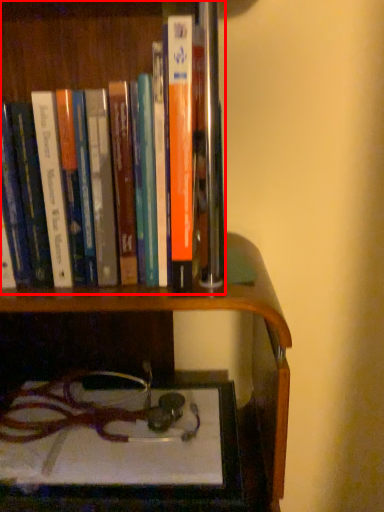
Question: Where is book (annotated by the red box) located in relation to shelf in the image?

Choices:
 (A) left
 (B) right

Answer: (A)